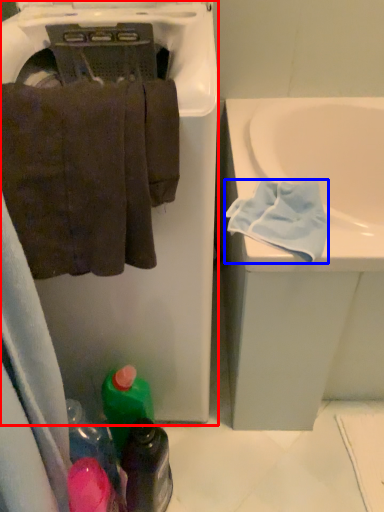
Question: Which object appears closest to the camera in this image, dish washer (highlighted by a red box) or bath towel (highlighted by a blue box)?

Choices:
 (A) dish washer
 (B) bath towel

Answer: (A)